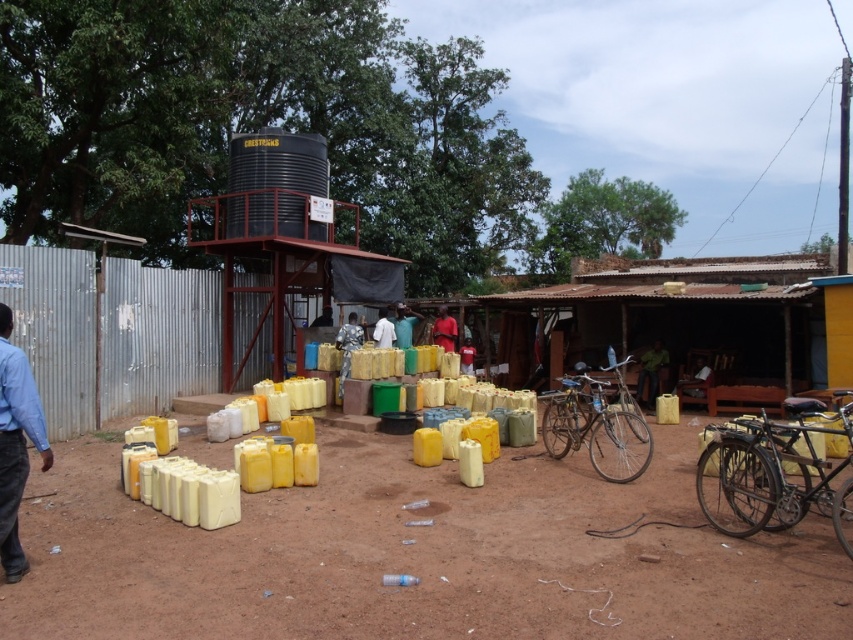
You are standing at the water distribution point and need to locate two specific points marked in the scene. Which point is closer to you, point 1 at coordinates point 1 at coordinates point [4,324] or point [392,333]?

Point point [4,324] is closer to the viewer than point [392,333], so the closer point is point [4,324].

You are a visitor approaching the water distribution point and see the matte red shirt at center and the blue fabric at center. Which object would appear closer to you as you walk towards the distribution point?

The matte red shirt at center appears closer to you because it is further to the viewer than the blue fabric at center, meaning it is positioned nearer in the scene.

You are a farmer checking the water distribution point. You see the brown dirt field at center and the blue fabric at center. Which object is taller?

The blue fabric at center is taller than the brown dirt field at center.